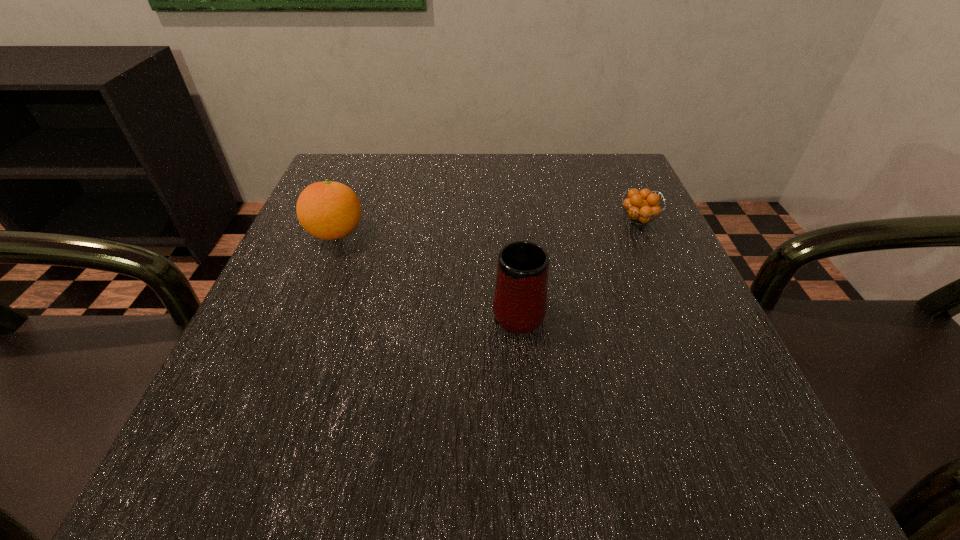
I want to click on free point located on the back of the rightmost object, so click(618, 174).

You are a GUI agent. You are given a task and a screenshot of the screen. Output one action in this format:
    pyautogui.click(x=<x>, y=<y>)
    Task: Click on the object positioned at the far edge
    This screenshot has width=960, height=540.
    Given the screenshot: What is the action you would take?
    tap(642, 206)

This screenshot has height=540, width=960. In order to click on object that is at the left edge in this screenshot , I will do `click(328, 210)`.

The image size is (960, 540). Find the location of `object that is at the right edge`. object that is at the right edge is located at coordinates (642, 206).

Identify the location of object located in the far right corner section of the desktop. (642, 206).

Where is `blank area at the far edge`? The image size is (960, 540). blank area at the far edge is located at coordinates (535, 164).

What are the coordinates of `vacant space at the near edge of the desktop` in the screenshot? It's located at (502, 500).

In the image, there is a desktop. Where is `free space at the left edge`? Image resolution: width=960 pixels, height=540 pixels. free space at the left edge is located at coordinates (313, 362).

This screenshot has height=540, width=960. What are the coordinates of `free space at the right edge` in the screenshot? It's located at (602, 225).

Image resolution: width=960 pixels, height=540 pixels. I want to click on free space at the far left corner of the desktop, so click(374, 176).